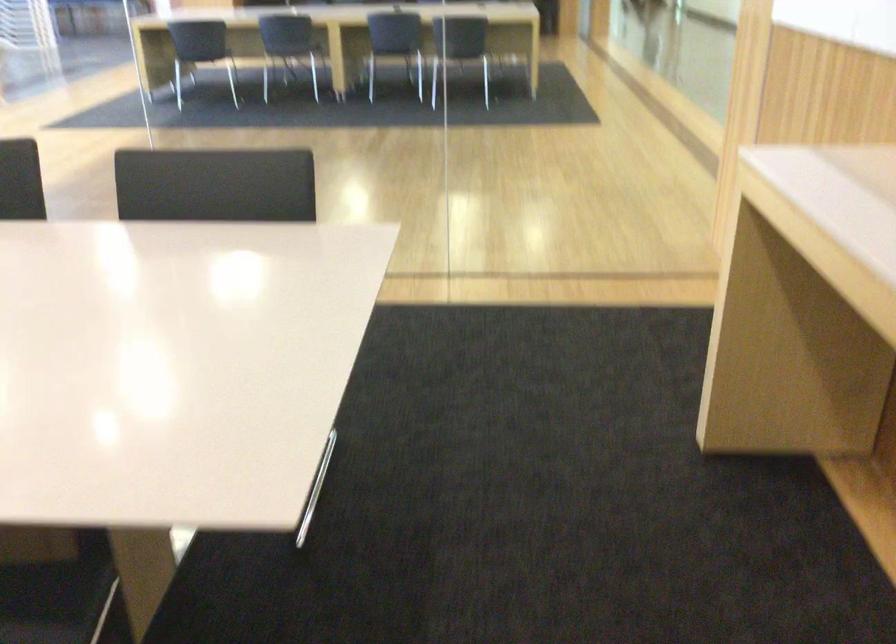
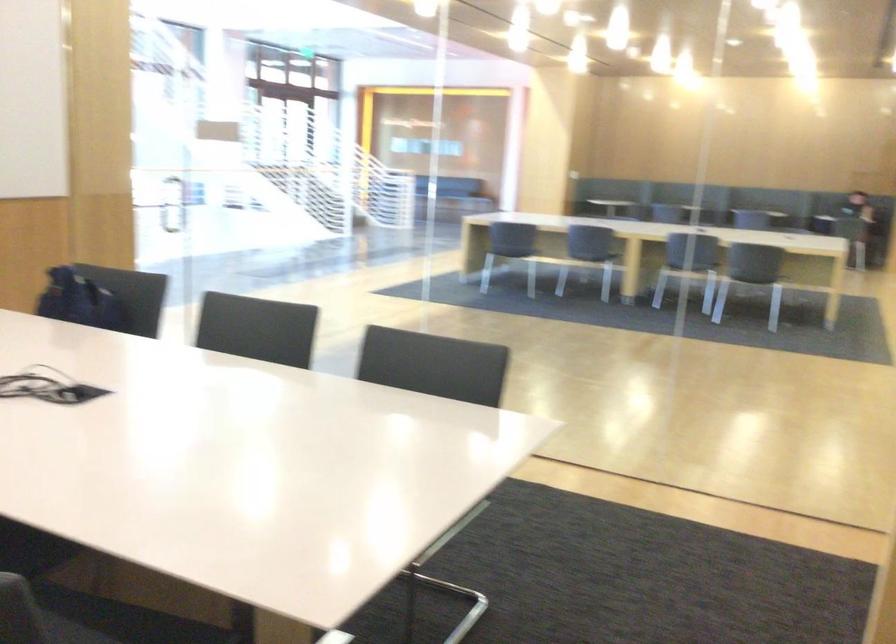
Question: How did the camera likely rotate?

Choices:
 (A) Left
 (B) Right
 (C) Up
 (D) Down

Answer: (A)